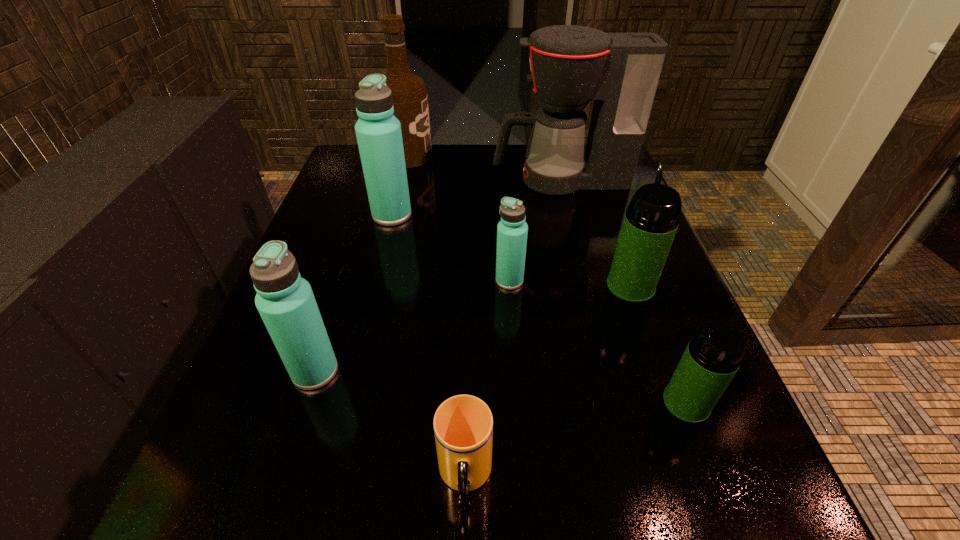
Locate an element on the screen. The width and height of the screenshot is (960, 540). the fourth object from left to right is located at coordinates (463, 425).

Where is `blank space located 0.270m on the label of the brown alcohol`? blank space located 0.270m on the label of the brown alcohol is located at coordinates (530, 156).

Find the location of a particular element. vacant space situated pour from the carafe of the coffee maker is located at coordinates click(370, 180).

You are a GUI agent. You are given a task and a screenshot of the screen. Output one action in this format:
    pyautogui.click(x=<x>, y=<y>)
    Task: Click on the blank space located pour from the carafe of the coffee maker
    
    Given the screenshot: What is the action you would take?
    pyautogui.click(x=445, y=180)

Find the location of a particular element. free location located pour from the carafe of the coffee maker is located at coordinates (405, 180).

Identify the location of vacant space situated 0.050m on the back of the tallest thermos bottle. The width and height of the screenshot is (960, 540). (397, 193).

This screenshot has width=960, height=540. I want to click on vacant area located from the spout of the farther green thermos bottle, so click(604, 212).

Where is `free space located 0.140m from the spout of the farther green thermos bottle`? Image resolution: width=960 pixels, height=540 pixels. free space located 0.140m from the spout of the farther green thermos bottle is located at coordinates (610, 228).

The image size is (960, 540). I want to click on free space located 0.290m from the spout of the farther green thermos bottle, so [x=596, y=191].

I want to click on free space located on the right of the nearest aqua thermos bottle, so click(414, 371).